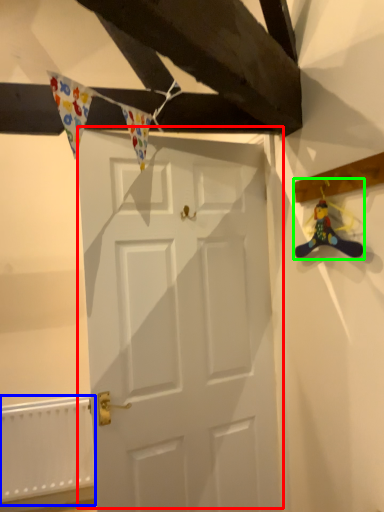
Question: Considering the real-world distances, which object is farthest from door (highlighted by a red box)? radiator (highlighted by a blue box) or miniature (highlighted by a green box)?

Choices:
 (A) radiator
 (B) miniature

Answer: (A)